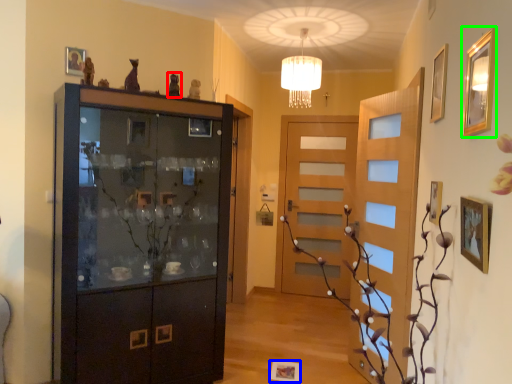
Question: Which object is positioned closest to art (highlighted by a red box)? Select from picture frame (highlighted by a blue box) and picture frame (highlighted by a green box).

Choices:
 (A) picture frame
 (B) picture frame

Answer: (B)